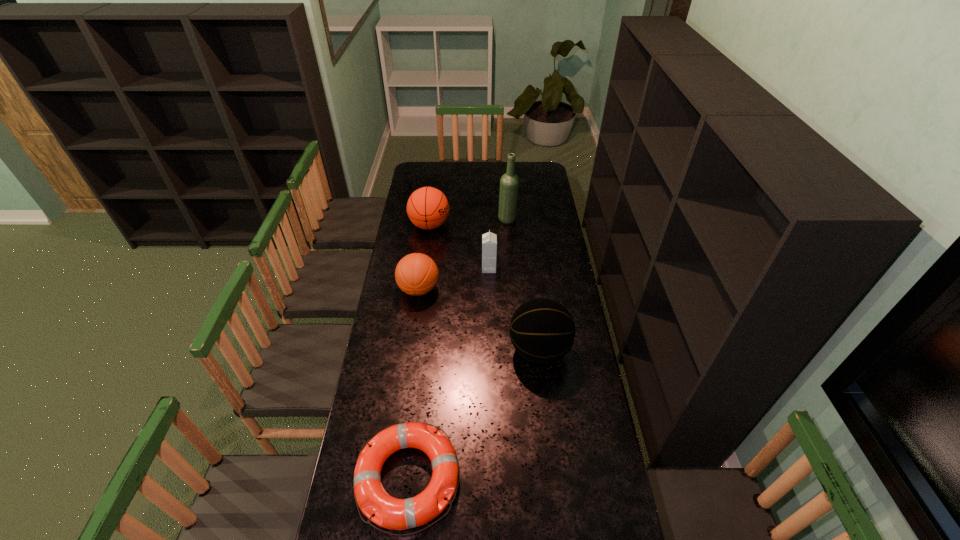
Find the location of a particular element. The width and height of the screenshot is (960, 540). free location at the far edge of the desktop is located at coordinates (518, 171).

The width and height of the screenshot is (960, 540). What are the coordinates of `vacant space at the left edge of the desktop` in the screenshot? It's located at click(x=419, y=247).

Find the location of a particular element. Image resolution: width=960 pixels, height=540 pixels. vacant region at the right edge of the desktop is located at coordinates (531, 206).

Where is `vacant space at the far left corner`? Image resolution: width=960 pixels, height=540 pixels. vacant space at the far left corner is located at coordinates (x=435, y=168).

In the image, there is a desktop. Where is `vacant space at the far right corner`? Image resolution: width=960 pixels, height=540 pixels. vacant space at the far right corner is located at coordinates pos(533,170).

At what (x,y) coordinates should I click in order to perform the action: click on vacant area between the nearest basketball and the farthest basketball. Please return your answer as a coordinate pair (x, y). This screenshot has width=960, height=540. Looking at the image, I should click on (485, 288).

Find the location of a particular element. This screenshot has width=960, height=540. free area in between the third nearest object and the nearest object is located at coordinates (414, 383).

The width and height of the screenshot is (960, 540). Identify the location of free area in between the carton and the wine bottle. (498, 244).

Find the location of a particular element. This screenshot has height=540, width=960. free space between the fourth farthest object and the wine bottle is located at coordinates (463, 254).

Identify the location of free space between the carton and the life buoy. Image resolution: width=960 pixels, height=540 pixels. pos(448,373).